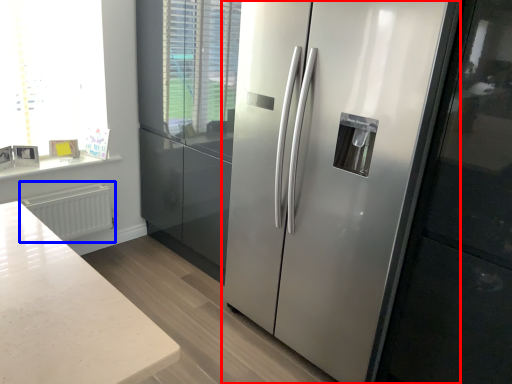
Question: Among these objects, which one is farthest to the camera, refrigerator (highlighted by a red box) or radiator (highlighted by a blue box)?

Choices:
 (A) refrigerator
 (B) radiator

Answer: (B)